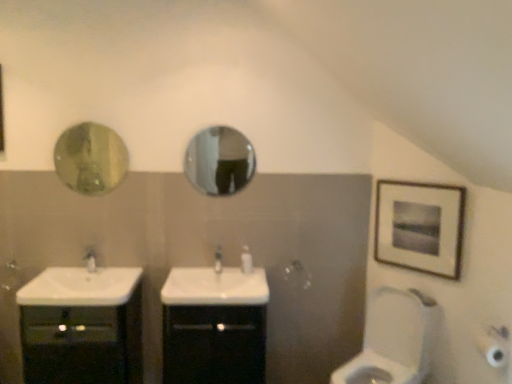
Question: Considering the relative sizes of glossy metallic mirror at center, which appears as the 2th mirror when viewed from the left, and white glossy tap at center, the second tap viewed from the right, in the image provided, is glossy metallic mirror at center, which appears as the 2th mirror when viewed from the left, shorter than white glossy tap at center, the second tap viewed from the right,?

Choices:
 (A) yes
 (B) no

Answer: (B)

Question: Is glossy metallic mirror at center, which appears as the 2th mirror when viewed from the left, oriented towards white glossy tap at center, positioned as the first tap in left-to-right order?

Choices:
 (A) no
 (B) yes

Answer: (A)

Question: Is glossy metallic mirror at center, which appears as the 2th mirror when viewed from the left, not within white glossy tap at center, the second tap viewed from the right?

Choices:
 (A) yes
 (B) no

Answer: (A)

Question: Is glossy metallic mirror at center, which is counted as the first mirror, starting from the right, to the left of white glossy tap at center, the second tap viewed from the right, from the viewer's perspective?

Choices:
 (A) no
 (B) yes

Answer: (A)

Question: Considering the relative sizes of glossy metallic mirror at center, which is counted as the first mirror, starting from the right, and white glossy tap at center, the second tap viewed from the right, in the image provided, is glossy metallic mirror at center, which is counted as the first mirror, starting from the right, bigger than white glossy tap at center, the second tap viewed from the right,?

Choices:
 (A) yes
 (B) no

Answer: (A)

Question: Is point 96,193 positioned closer to the camera than point 120,289?

Choices:
 (A) farther
 (B) closer

Answer: (A)

Question: Based on their sizes in the image, would you say green glass mirror at upper left, the first mirror in the left-to-right sequence, is bigger or smaller than white glossy sink at lower left, the second sink in the right-to-left sequence?

Choices:
 (A) small
 (B) big

Answer: (A)

Question: From their relative heights in the image, would you say green glass mirror at upper left, the first mirror in the left-to-right sequence, is taller or shorter than white glossy sink at lower left, which appears as the first sink when viewed from the left?

Choices:
 (A) short
 (B) tall

Answer: (B)

Question: From a real-world perspective, is green glass mirror at upper left, the first mirror in the left-to-right sequence, physically located above or below white glossy sink at lower left, which appears as the first sink when viewed from the left?

Choices:
 (A) above
 (B) below

Answer: (A)

Question: From the image's perspective, is green glass mirror at upper left, the first mirror in the left-to-right sequence, located above or below black glossy cabinet at center, the second bathroom cabinet from the left?

Choices:
 (A) above
 (B) below

Answer: (A)

Question: Choose the correct answer: Is green glass mirror at upper left, the first mirror in the left-to-right sequence, inside black glossy cabinet at center, the first bathroom cabinet from the right, or outside it?

Choices:
 (A) inside
 (B) outside

Answer: (B)

Question: Is green glass mirror at upper left, the first mirror in the left-to-right sequence, wider or thinner than black glossy cabinet at center, the first bathroom cabinet from the right?

Choices:
 (A) wide
 (B) thin

Answer: (B)

Question: Is green glass mirror at upper left, which ranks as the 2th mirror in right-to-left order, taller or shorter than black glossy cabinet at center, the first bathroom cabinet from the right?

Choices:
 (A) tall
 (B) short

Answer: (B)

Question: From the image's perspective, is wooden framed artwork at upper right above or below white glossy tap at center, positioned as the first tap in left-to-right order?

Choices:
 (A) above
 (B) below

Answer: (A)

Question: Considering the positions of point (374, 238) and point (93, 261), is point (374, 238) closer or farther from the camera than point (93, 261)?

Choices:
 (A) farther
 (B) closer

Answer: (A)